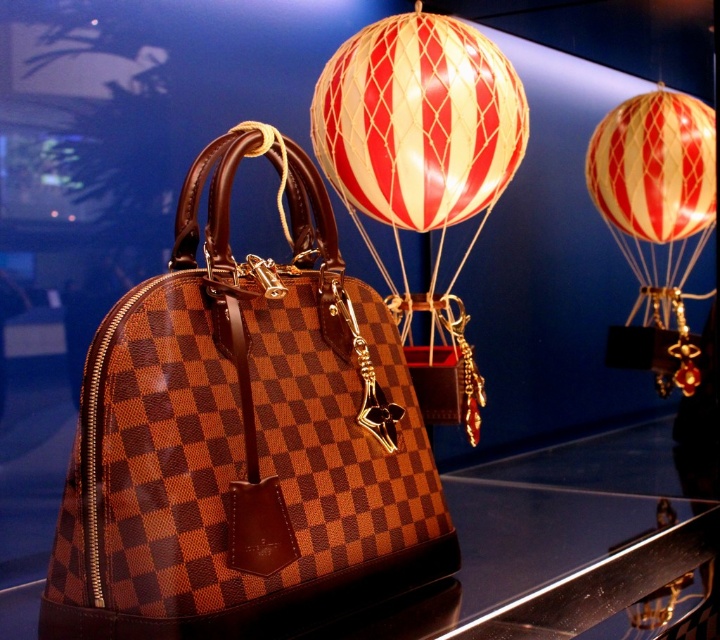
Locate an element on the screen. Image resolution: width=720 pixels, height=640 pixels. brown checkered bag at center is located at coordinates (243, 442).

Who is more forward, (228, 188) or (594, 163)?

Point (228, 188) is in front.

Identify the location of brown checkered bag at center. The image size is (720, 640). (243, 442).

How distant is red and white striped balloon at upper center from red striped balloon at upper right?

red and white striped balloon at upper center is 16.20 inches away from red striped balloon at upper right.

Image resolution: width=720 pixels, height=640 pixels. What are the coordinates of `red and white striped balloon at upper center` in the screenshot? It's located at (418, 122).

The height and width of the screenshot is (640, 720). I want to click on red and white striped balloon at upper center, so click(418, 122).

Is point (703, 556) closer to camera compared to point (451, 93)?

No, (703, 556) is behind (451, 93).

This screenshot has height=640, width=720. Describe the element at coordinates (567, 545) in the screenshot. I see `transparent glass table at center` at that location.

This screenshot has width=720, height=640. What do you see at coordinates (567, 545) in the screenshot? I see `transparent glass table at center` at bounding box center [567, 545].

The width and height of the screenshot is (720, 640). Find the location of `transparent glass table at center`. transparent glass table at center is located at coordinates (567, 545).